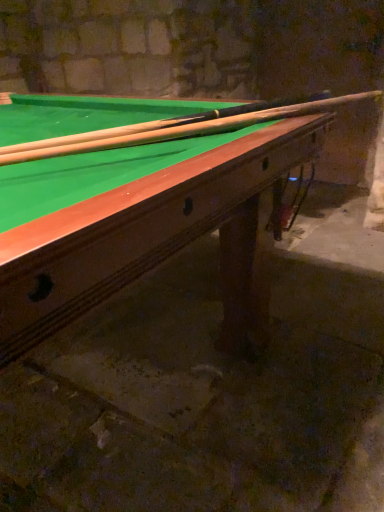
Question: Should I look upward or downward to see green felt billiard table at upper center?

Choices:
 (A) up
 (B) down

Answer: (A)

Question: Is green felt billiard table at upper center positioned beyond the bounds of wooden cue at upper center?

Choices:
 (A) no
 (B) yes

Answer: (B)

Question: From a real-world perspective, does green felt billiard table at upper center sit lower than wooden cue at upper center?

Choices:
 (A) yes
 (B) no

Answer: (A)

Question: From the image's perspective, is green felt billiard table at upper center above wooden cue at upper center?

Choices:
 (A) no
 (B) yes

Answer: (A)

Question: Could you tell me if green felt billiard table at upper center is turned towards wooden cue at upper center?

Choices:
 (A) no
 (B) yes

Answer: (A)

Question: Can you confirm if green felt billiard table at upper center is taller than wooden cue at upper center?

Choices:
 (A) yes
 (B) no

Answer: (A)

Question: Would you say green felt billiard table at upper center is a long distance from wooden cue at upper center?

Choices:
 (A) yes
 (B) no

Answer: (B)

Question: Is wooden cue at upper center facing away from green felt billiard table at upper center?

Choices:
 (A) yes
 (B) no

Answer: (A)

Question: Are wooden cue at upper center and green felt billiard table at upper center far apart?

Choices:
 (A) no
 (B) yes

Answer: (A)

Question: From a real-world perspective, does wooden cue at upper center sit lower than green felt billiard table at upper center?

Choices:
 (A) no
 (B) yes

Answer: (A)

Question: Does wooden cue at upper center have a smaller size compared to green felt billiard table at upper center?

Choices:
 (A) no
 (B) yes

Answer: (B)

Question: Could green felt billiard table at upper center be considered to be inside wooden cue at upper center?

Choices:
 (A) yes
 (B) no

Answer: (B)

Question: Is wooden cue at upper center with green felt billiard table at upper center?

Choices:
 (A) no
 (B) yes

Answer: (A)

Question: From the image's perspective, is wooden cue at upper center above or below green felt billiard table at upper center?

Choices:
 (A) below
 (B) above

Answer: (B)